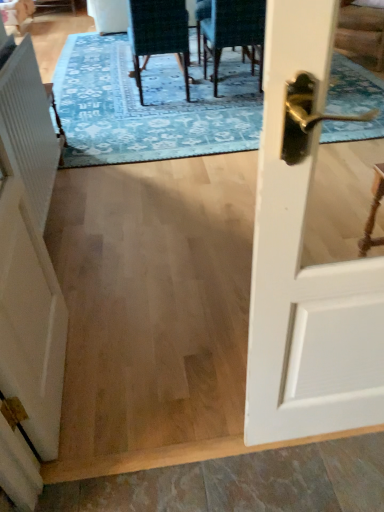
You are a GUI agent. You are given a task and a screenshot of the screen. Output one action in this format:
    pyautogui.click(x=<x>, y=<y>)
    Task: Click on the vacant area to the right of white matte barn door at left
    The image size is (384, 512).
    Given the screenshot: What is the action you would take?
    pyautogui.click(x=152, y=362)